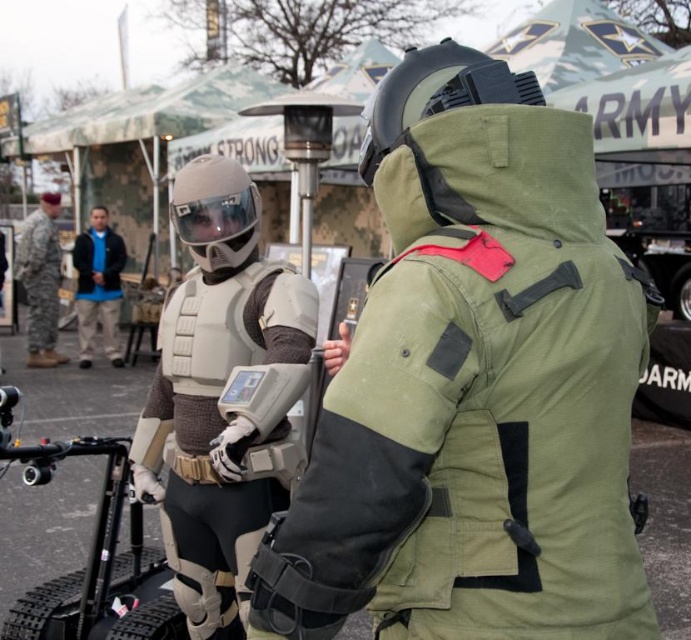
Who is taller, matte gray armor at center or black matte helmet at upper center?

With more height is matte gray armor at center.

Which is above, matte gray armor at center or black matte helmet at upper center?

black matte helmet at upper center is above.

Describe the element at coordinates (223, 396) in the screenshot. I see `matte gray armor at center` at that location.

You are a GUI agent. You are given a task and a screenshot of the screen. Output one action in this format:
    pyautogui.click(x=<x>, y=<y>)
    Task: Click on the matte gray armor at center
    This screenshot has height=640, width=691.
    Given the screenshot: What is the action you would take?
    pyautogui.click(x=223, y=396)

Which is more to the left, olive green fabric jacket at center or clear plastic goggles at center?

Positioned to the left is clear plastic goggles at center.

Is point (473, 460) positioned after point (211, 211)?

No, it is not.

Locate an element on the screen. The image size is (691, 640). olive green fabric jacket at center is located at coordinates (473, 387).

Is point (255, 204) farther from viewer compared to point (3, 264)?

That is False.

Does clear plastic goggles at center appear over matte black helmet at upper center?

No, clear plastic goggles at center is not above matte black helmet at upper center.

This screenshot has width=691, height=640. What do you see at coordinates (216, 216) in the screenshot? I see `clear plastic goggles at center` at bounding box center [216, 216].

The width and height of the screenshot is (691, 640). In order to click on clear plastic goggles at center in this screenshot , I will do `click(216, 216)`.